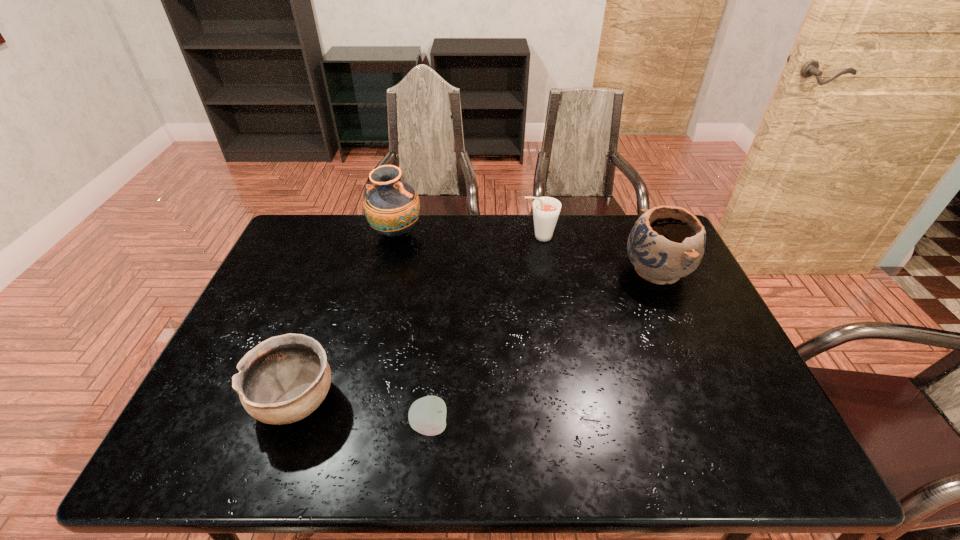
Identify the location of free location located 0.070m on the left of the second tallest pottery. (600, 272).

Where is `vacant region located 0.130m on the drink side of the second object from right to left`? vacant region located 0.130m on the drink side of the second object from right to left is located at coordinates (484, 237).

The height and width of the screenshot is (540, 960). I want to click on vacant region located on the drink side of the second object from right to left, so click(x=420, y=237).

At what (x,y) coordinates should I click in order to perform the action: click on vacant space situated on the drink side of the second object from right to left. Please return your answer as a coordinate pair (x, y). Image resolution: width=960 pixels, height=540 pixels. Looking at the image, I should click on (425, 237).

Find the location of `free space located on the right of the second shortest object`. free space located on the right of the second shortest object is located at coordinates (384, 401).

At what (x,y) coordinates should I click in order to perform the action: click on vacant area situated 0.210m on the left of the apple. Please return your answer as a coordinate pair (x, y). The image size is (960, 540). Looking at the image, I should click on (318, 426).

In order to click on root beer that is at the far edge in this screenshot , I will do (x=546, y=210).

The width and height of the screenshot is (960, 540). In order to click on pottery that is at the near edge in this screenshot , I will do `click(282, 380)`.

This screenshot has width=960, height=540. I want to click on apple that is at the near edge, so (x=427, y=415).

Where is `object that is positioned at the left edge`? The width and height of the screenshot is (960, 540). object that is positioned at the left edge is located at coordinates (282, 380).